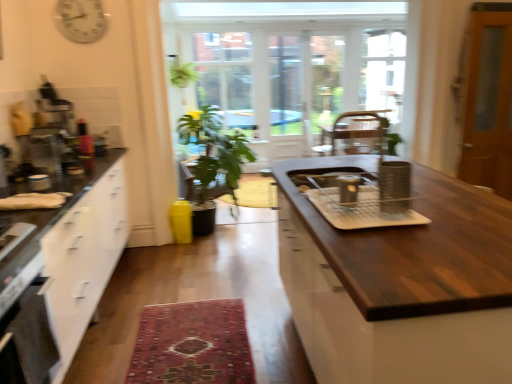
You are a GUI agent. You are given a task and a screenshot of the screen. Output one action in this format:
    pyautogui.click(x=<x>, y=<y>)
    Task: Click on the free space to the back side of metallic silver canister at center, which is the 3th appliance in left-to-right order
    This screenshot has height=384, width=512.
    Given the screenshot: What is the action you would take?
    pyautogui.click(x=337, y=190)